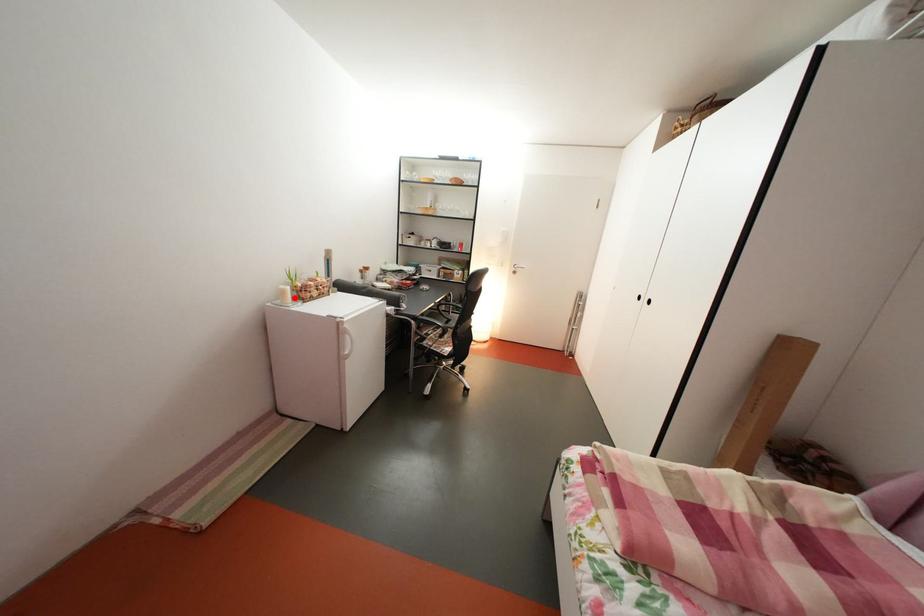
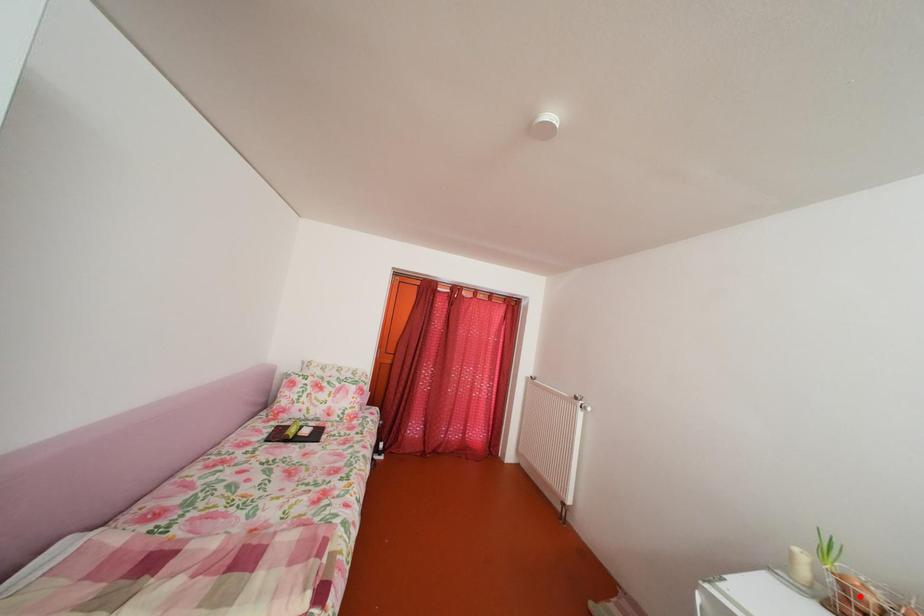
I am providing you with two images of the same scene from different viewpoints. A red point is marked on the first image and another point is marked on the second image. Does the point marked in image1 correspond to the same location as the one in image2?

No